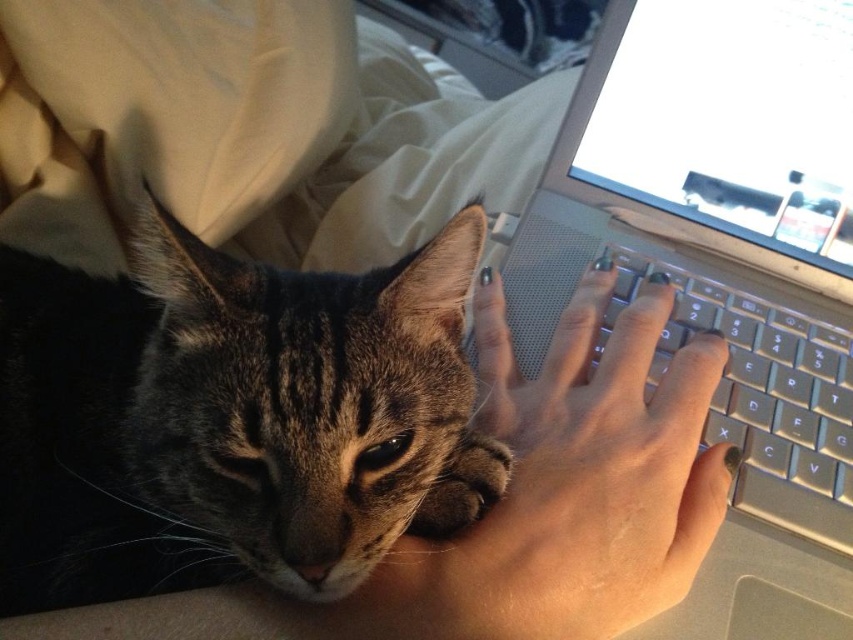
Is point (457, 456) closer to camera compared to point (602, 436)?

Yes, point (457, 456) is closer to viewer.

Is tabby fur cat at center to the left of smooth skin hand at center from the viewer's perspective?

Yes, tabby fur cat at center is to the left of smooth skin hand at center.

The height and width of the screenshot is (640, 853). Describe the element at coordinates (231, 419) in the screenshot. I see `tabby fur cat at center` at that location.

Locate an element on the screen. Image resolution: width=853 pixels, height=640 pixels. tabby fur cat at center is located at coordinates (231, 419).

Is silver metallic laptop at center further to camera compared to smooth skin hand at center?

Yes.

Can you confirm if silver metallic laptop at center is smaller than smooth skin hand at center?

Incorrect, silver metallic laptop at center is not smaller in size than smooth skin hand at center.

Between point (723, 388) and point (363, 612), which one is positioned behind?

The point (723, 388) is more distant.

The height and width of the screenshot is (640, 853). I want to click on silver metallic laptop at center, so click(723, 269).

Which is above, silver metallic laptop at center or silver metallic keyboard at center right?

silver metallic laptop at center

Can you confirm if silver metallic laptop at center is bigger than silver metallic keyboard at center right?

Yes, silver metallic laptop at center is bigger than silver metallic keyboard at center right.

Between point (834, 509) and point (782, 481), which one is positioned behind?

Positioned behind is point (782, 481).

I want to click on silver metallic laptop at center, so click(723, 269).